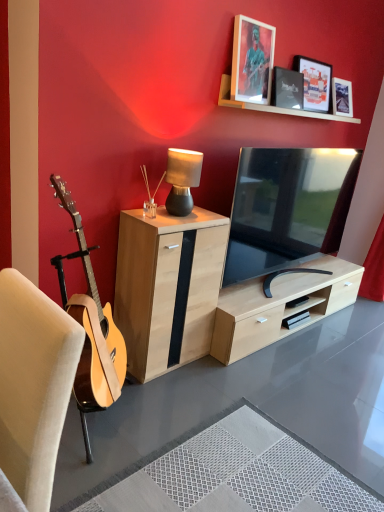
Locate an element on the screen. The width and height of the screenshot is (384, 512). wooden shelf at upper center is located at coordinates (274, 106).

Measure the distance between matte black tv at center and camera.

matte black tv at center is 2.39 meters away from camera.

Locate an element on the screen. natural wood cabinet at center is located at coordinates 167,287.

In order to face matte black table lamp at center, should I rotate leftwards or rightwards?

Turn left approximately 1.050 degrees to face it.

Measure the distance between metallic silver picture frame at upper center, placed as the 1th picture frame when sorted from left to right, and camera.

The depth of metallic silver picture frame at upper center, placed as the 1th picture frame when sorted from left to right, is 7.42 feet.

What do you see at coordinates (315, 83) in the screenshot? I see `matte black picture frame at upper center, which appears as the third picture frame when viewed from the left` at bounding box center [315, 83].

In order to click on wooden shelf at upper center in this screenshot , I will do `click(274, 106)`.

Between matte black picture frame at upper center, which ranks as the 1th picture frame in right-to-left order, and natural wood cabinet at center, which one appears on the left side from the viewer's perspective?

Positioned to the left is natural wood cabinet at center.

From a real-world perspective, is matte black picture frame at upper center, which appears as the third picture frame when viewed from the left, located higher than natural wood cabinet at center?

Yes, from a real-world perspective, matte black picture frame at upper center, which appears as the third picture frame when viewed from the left, is over natural wood cabinet at center

What's the angular difference between matte black picture frame at upper center, which appears as the third picture frame when viewed from the left, and natural wood cabinet at center's facing directions?

They differ by 1.89 degrees in their facing directions.

Which object is more forward, matte black picture frame at upper center, which appears as the third picture frame when viewed from the left, or natural wood cabinet at center?

natural wood cabinet at center.

Is matte black table lamp at center further to camera compared to metallic silver picture frame at upper center, the third picture frame in the right-to-left sequence?

No, matte black table lamp at center is in front of metallic silver picture frame at upper center, the third picture frame in the right-to-left sequence.

Is matte black table lamp at center facing towards metallic silver picture frame at upper center, the third picture frame in the right-to-left sequence?

No.

What's the angular difference between matte black table lamp at center and metallic silver picture frame at upper center, the third picture frame in the right-to-left sequence,'s facing directions?

matte black table lamp at center and metallic silver picture frame at upper center, the third picture frame in the right-to-left sequence, are facing 3.72 degrees away from each other.

Based on their sizes in the image, would you say matte black table lamp at center is bigger or smaller than metallic silver picture frame at upper center, the third picture frame in the right-to-left sequence?

Considering their sizes, matte black table lamp at center takes up less space than metallic silver picture frame at upper center, the third picture frame in the right-to-left sequence.

From the picture: Is natural wood cabinet at center aimed at black matte picture frame at upper center, marked as the 2th picture frame in a right-to-left arrangement?

No.

There is a natural wood cabinet at center. Where is `the 1st picture frame above it (from the image's perspective)`? This screenshot has height=512, width=384. the 1st picture frame above it (from the image's perspective) is located at coordinates (287, 88).

From the image's perspective, is natural wood cabinet at center above black matte picture frame at upper center, marked as the 2th picture frame in a right-to-left arrangement?

No.

Is natural wood cabinet at center placed right next to black matte picture frame at upper center, marked as the 2th picture frame in a right-to-left arrangement?

There is a gap between natural wood cabinet at center and black matte picture frame at upper center, marked as the 2th picture frame in a right-to-left arrangement.

Is matte black picture frame at upper center, which appears as the third picture frame when viewed from the left, at the left side of matte black table lamp at center?

No, matte black picture frame at upper center, which appears as the third picture frame when viewed from the left, is not to the left of matte black table lamp at center.

From the image's perspective, is matte black picture frame at upper center, which appears as the third picture frame when viewed from the left, on top of matte black table lamp at center?

Yes.

Is matte black picture frame at upper center, which ranks as the 1th picture frame in right-to-left order, bigger or smaller than matte black table lamp at center?

In the image, matte black picture frame at upper center, which ranks as the 1th picture frame in right-to-left order, appears to be larger than matte black table lamp at center.

Which object is positioned more to the right, matte black picture frame at upper center, which ranks as the 1th picture frame in right-to-left order, or beige fabric chair at left?

matte black picture frame at upper center, which ranks as the 1th picture frame in right-to-left order.

Between matte black picture frame at upper center, which ranks as the 1th picture frame in right-to-left order, and beige fabric chair at left, which one has larger size?

beige fabric chair at left is bigger.

Is the surface of matte black picture frame at upper center, which ranks as the 1th picture frame in right-to-left order, in direct contact with beige fabric chair at left?

No, matte black picture frame at upper center, which ranks as the 1th picture frame in right-to-left order, is not beside beige fabric chair at left.

In the image, there is a matte black picture frame at upper center, which appears as the third picture frame when viewed from the left. Identify the location of chair below it (from the image's perspective). The image size is (384, 512). (33, 386).

Relative to wooden shelf at upper center, is natural wood cabinet at center in front or behind?

natural wood cabinet at center is in front of wooden shelf at upper center.

Is natural wood cabinet at center facing away from wooden shelf at upper center?

No.

Considering the relative sizes of natural wood cabinet at center and wooden shelf at upper center in the image provided, is natural wood cabinet at center wider than wooden shelf at upper center?

Indeed, natural wood cabinet at center has a greater width compared to wooden shelf at upper center.

Is natural wood cabinet at center surrounding wooden shelf at upper center?

Definitely not — wooden shelf at upper center is not inside natural wood cabinet at center.

Consider the image. From the image's perspective, is wooden shelf at upper center above matte black picture frame at upper center, which appears as the third picture frame when viewed from the left?

No.

Considering the relative sizes of wooden shelf at upper center and matte black picture frame at upper center, which ranks as the 1th picture frame in right-to-left order, in the image provided, is wooden shelf at upper center smaller than matte black picture frame at upper center, which ranks as the 1th picture frame in right-to-left order,?

No.

Is wooden shelf at upper center positioned beyond the bounds of matte black picture frame at upper center, which appears as the third picture frame when viewed from the left?

Absolutely, wooden shelf at upper center is external to matte black picture frame at upper center, which appears as the third picture frame when viewed from the left.

You are a GUI agent. You are given a task and a screenshot of the screen. Output one action in this format:
    pyautogui.click(x=<x>, y=<y>)
    Task: Click on the picture frame that is the 3rd one when counting upward from the natural wood cabinet at center (from the image's perspective)
    
    Given the screenshot: What is the action you would take?
    pyautogui.click(x=315, y=83)

Where is `table lamp beneath the metallic silver picture frame at upper center, the third picture frame in the right-to-left sequence (from a real-world perspective)`? table lamp beneath the metallic silver picture frame at upper center, the third picture frame in the right-to-left sequence (from a real-world perspective) is located at coordinates (182, 179).

Looking at the image, which one is located closer to metallic silver picture frame at upper center, the third picture frame in the right-to-left sequence, matte black tv at center or wooden shelf at upper center?

wooden shelf at upper center is positioned closer to the anchor metallic silver picture frame at upper center, the third picture frame in the right-to-left sequence.

From the image, which object appears to be farther from wooden shelf at upper center, matte black tv at center or black matte picture frame at upper center, the 2th picture frame in the left-to-right sequence?

The object further to wooden shelf at upper center is matte black tv at center.

Estimate the real-world distances between objects in this image. Which object is further from matte black table lamp at center, matte black tv at center or metallic silver picture frame at upper center, placed as the 1th picture frame when sorted from left to right?

The object further to matte black table lamp at center is matte black tv at center.

Estimate the real-world distances between objects in this image. Which object is closer to natural wood cabinet at center, metallic silver picture frame at upper center, the third picture frame in the right-to-left sequence, or matte black tv at center?

The object closer to natural wood cabinet at center is matte black tv at center.

Looking at the image, which one is located further to matte black table lamp at center, matte black picture frame at upper center, which appears as the third picture frame when viewed from the left, or black matte picture frame at upper center, marked as the 2th picture frame in a right-to-left arrangement?

Among the two, matte black picture frame at upper center, which appears as the third picture frame when viewed from the left, is located further to matte black table lamp at center.

Based on their spatial positions, is matte black table lamp at center or white textured rug at lower center closer to metallic silver picture frame at upper center, the third picture frame in the right-to-left sequence?

Based on the image, matte black table lamp at center appears to be nearer to metallic silver picture frame at upper center, the third picture frame in the right-to-left sequence.

Estimate the real-world distances between objects in this image. Which object is further from natural wood cabinet at center, matte black table lamp at center or white textured rug at lower center?

white textured rug at lower center is positioned further to the anchor natural wood cabinet at center.

Based on the photo, based on their spatial positions, is matte black table lamp at center or white textured rug at lower center closer to matte black picture frame at upper center, which appears as the third picture frame when viewed from the left?

matte black table lamp at center.

Where is `cabinetry between white textured rug at lower center and matte black tv at center from front to back`? cabinetry between white textured rug at lower center and matte black tv at center from front to back is located at coordinates (167, 287).

The height and width of the screenshot is (512, 384). I want to click on shelf between metallic silver picture frame at upper center, the third picture frame in the right-to-left sequence, and white textured rug at lower center vertically, so click(274, 106).

Locate an element on the screen. The height and width of the screenshot is (512, 384). television between metallic silver picture frame at upper center, the third picture frame in the right-to-left sequence, and natural wood cabinet at center in the up-down direction is located at coordinates (287, 207).

Image resolution: width=384 pixels, height=512 pixels. What are the coordinates of `picture frame positioned between wooden shelf at upper center and matte black picture frame at upper center, which ranks as the 1th picture frame in right-to-left order, from near to far` in the screenshot? It's located at (287, 88).